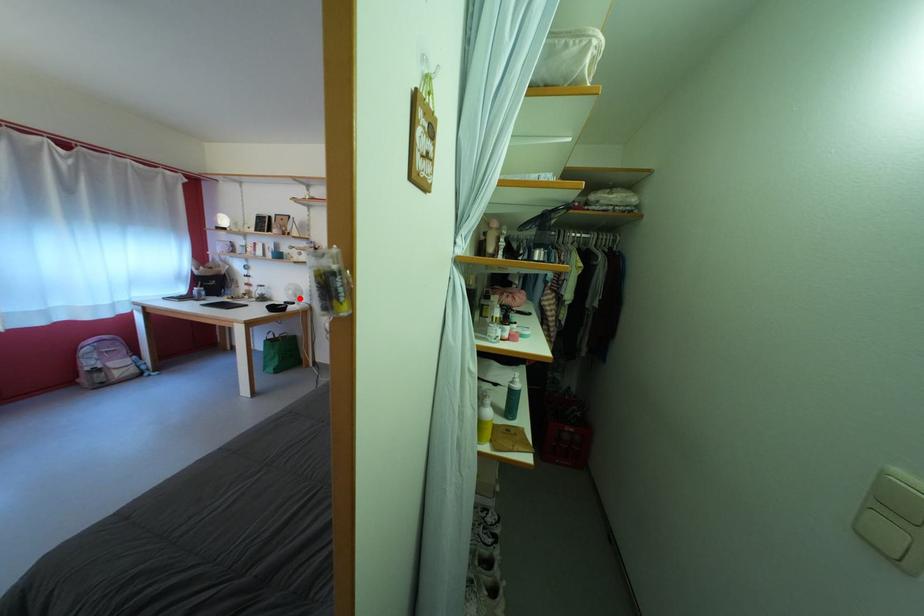
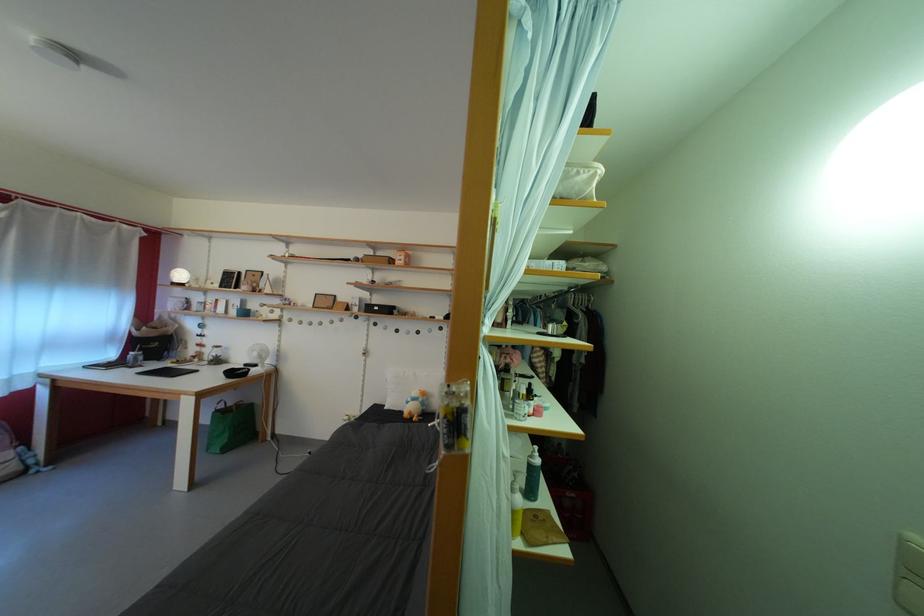
In the second image, find the point that corresponds to the highlighted location in the first image.

(263, 360)